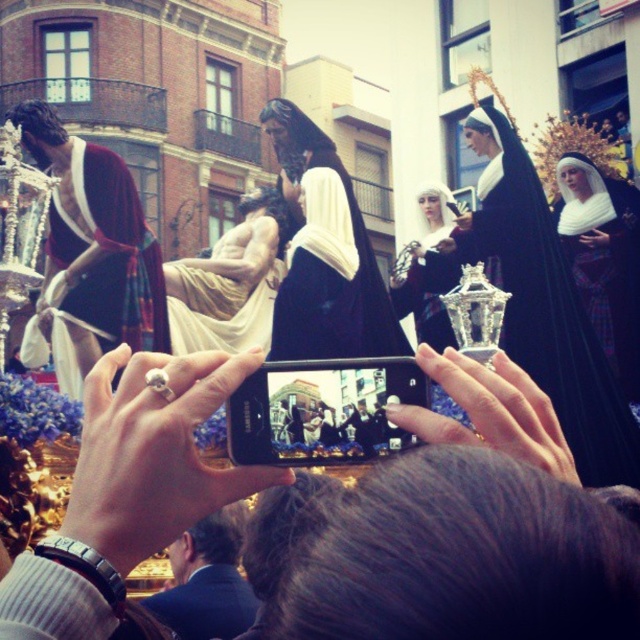
This screenshot has height=640, width=640. What do you see at coordinates (90, 256) in the screenshot?
I see `matte black statue at left` at bounding box center [90, 256].

Is point (80, 305) behind point (477, 339)?

No, (80, 305) is in front of (477, 339).

At what (x,y) coordinates should I click in order to perform the action: click on matte black statue at left. Please return your answer as a coordinate pair (x, y). Looking at the image, I should click on (90, 256).

Is black velvet nun at upper center thinner than matte black dress at center?

In fact, black velvet nun at upper center might be wider than matte black dress at center.

Between point (493, 272) and point (436, 289), which one is positioned behind?

The point (436, 289) is behind.

Is point (531, 218) farther from viewer compared to point (413, 260)?

No.

Image resolution: width=640 pixels, height=640 pixels. In order to click on black velvet nun at upper center in this screenshot , I will do `click(541, 304)`.

Is point (280, 260) farther from camera compared to point (604, 320)?

Yes.

Is the position of matte gold statue at center more distant than that of white woolen veil at upper right?

That is False.

Is point (253, 339) farther from viewer compared to point (595, 212)?

No, it is in front of (595, 212).

Find the location of `matte gold statue at center`. matte gold statue at center is located at coordinates (230, 282).